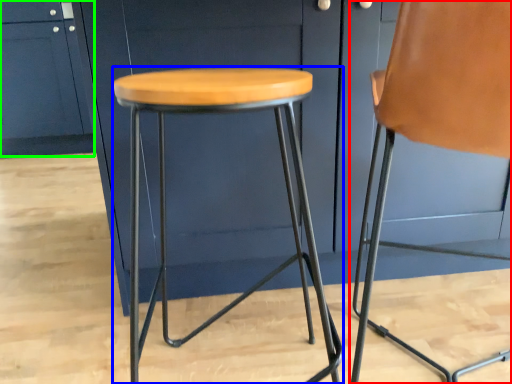
Question: Based on their relative distances, which object is farther from chair (highlighted by a red box)? Choose from stool (highlighted by a blue box) and cabinetry (highlighted by a green box).

Choices:
 (A) stool
 (B) cabinetry

Answer: (B)